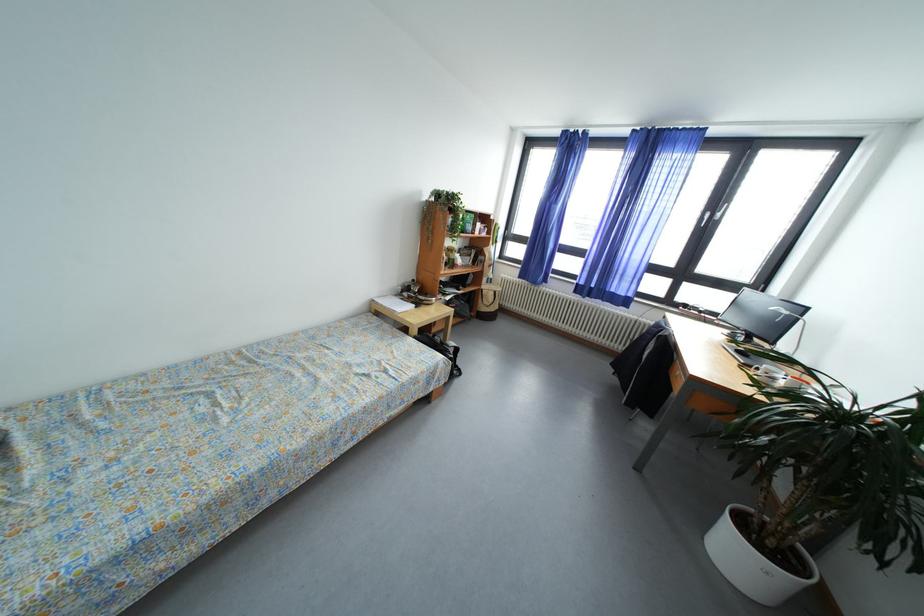
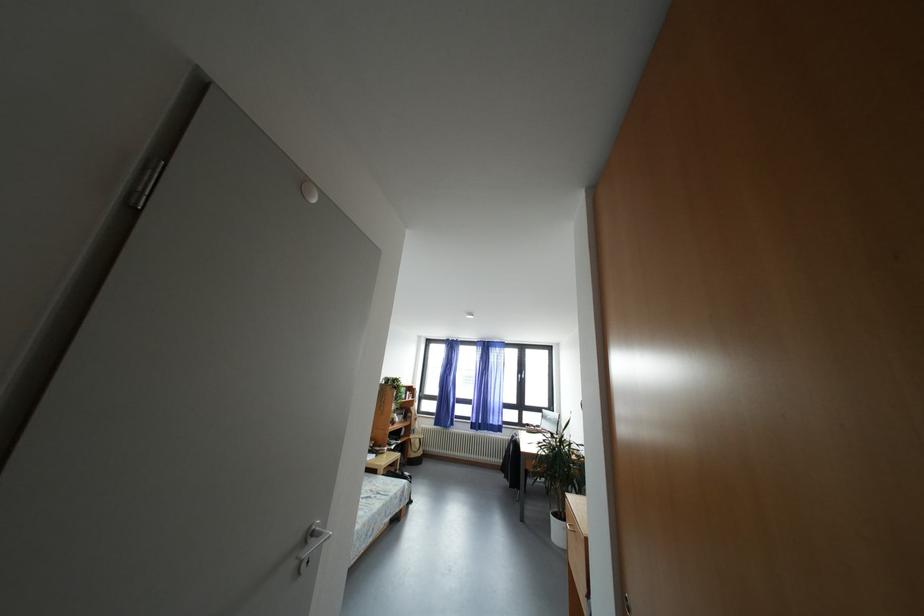
Locate, in the second image, the point that corresponds to (691,310) in the first image.

(533, 430)